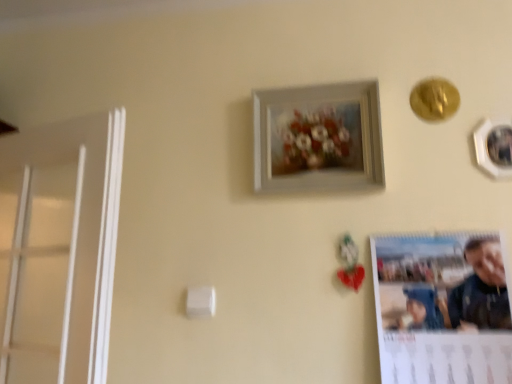
Question: From the image's perspective, is white matte picture frame at upper center, acting as the 2th picture frame starting from the right, above matte paper calendar at lower right?

Choices:
 (A) no
 (B) yes

Answer: (B)

Question: From the image's perspective, is white matte picture frame at upper center, the first picture frame in the left-to-right sequence, beneath matte paper calendar at lower right?

Choices:
 (A) no
 (B) yes

Answer: (A)

Question: Does white matte picture frame at upper center, the first picture frame in the left-to-right sequence, lie behind matte paper calendar at lower right?

Choices:
 (A) no
 (B) yes

Answer: (B)

Question: From a real-world perspective, is white matte picture frame at upper center, the first picture frame in the left-to-right sequence, over matte paper calendar at lower right?

Choices:
 (A) yes
 (B) no

Answer: (A)

Question: Is white matte picture frame at upper center, the first picture frame in the left-to-right sequence, at the left side of matte paper calendar at lower right?

Choices:
 (A) no
 (B) yes

Answer: (B)

Question: Considering the positions of white glossy picture frame at upper right, the 2th picture frame from the left, and white matte picture frame at upper center, the first picture frame in the left-to-right sequence, in the image, is white glossy picture frame at upper right, the 2th picture frame from the left, wider or thinner than white matte picture frame at upper center, the first picture frame in the left-to-right sequence,?

Choices:
 (A) thin
 (B) wide

Answer: (A)

Question: Would you say white glossy picture frame at upper right, placed as the first picture frame when sorted from right to left, is to the left or to the right of white matte picture frame at upper center, acting as the 2th picture frame starting from the right, in the picture?

Choices:
 (A) left
 (B) right

Answer: (B)

Question: From a real-world perspective, is white glossy picture frame at upper right, the 2th picture frame from the left, above or below white matte picture frame at upper center, acting as the 2th picture frame starting from the right?

Choices:
 (A) below
 (B) above

Answer: (A)

Question: Relative to white matte picture frame at upper center, the first picture frame in the left-to-right sequence, is white glossy picture frame at upper right, the 2th picture frame from the left, in front or behind?

Choices:
 (A) behind
 (B) front

Answer: (B)

Question: Is matte paper calendar at lower right bigger or smaller than white glossy picture frame at upper right, the 2th picture frame from the left?

Choices:
 (A) small
 (B) big

Answer: (B)

Question: From the image's perspective, is matte paper calendar at lower right located above or below white glossy picture frame at upper right, the 2th picture frame from the left?

Choices:
 (A) above
 (B) below

Answer: (B)

Question: Looking at their shapes, would you say matte paper calendar at lower right is wider or thinner than white glossy picture frame at upper right, placed as the first picture frame when sorted from right to left?

Choices:
 (A) thin
 (B) wide

Answer: (B)

Question: Relative to white glossy picture frame at upper right, the 2th picture frame from the left, is matte paper calendar at lower right in front or behind?

Choices:
 (A) behind
 (B) front

Answer: (B)

Question: Looking at the image, does white matte picture frame at upper center, acting as the 2th picture frame starting from the right, seem bigger or smaller compared to matte paper calendar at lower right?

Choices:
 (A) small
 (B) big

Answer: (A)

Question: Looking at their shapes, would you say white matte picture frame at upper center, the first picture frame in the left-to-right sequence, is wider or thinner than matte paper calendar at lower right?

Choices:
 (A) wide
 (B) thin

Answer: (A)